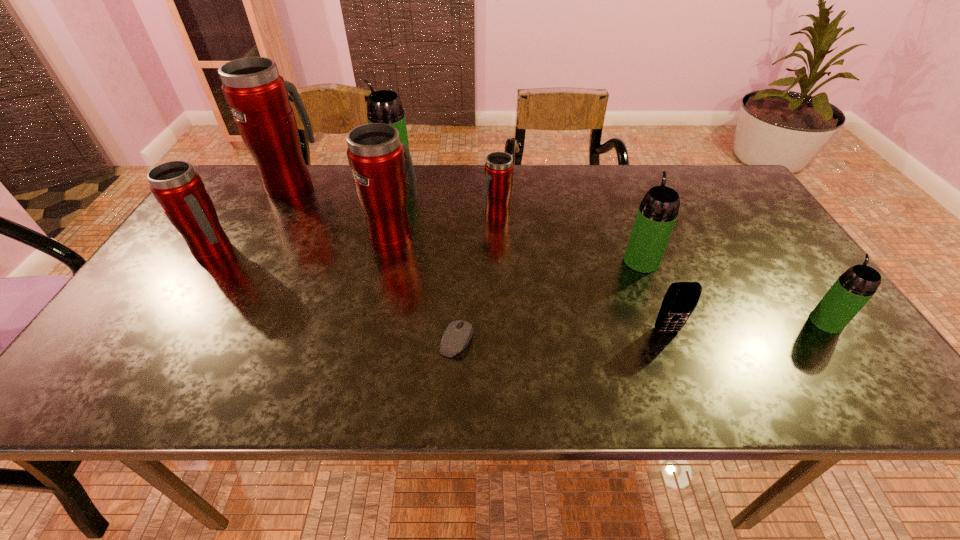
In order to click on unoccupied position between the second red thermos bottle from right to left and the second smallest red thermos bottle in this screenshot , I will do [304, 244].

The width and height of the screenshot is (960, 540). Identify the location of vacant space in between the sixth object from left to right and the second smallest red thermos bottle. (356, 234).

Where is `vacant region between the second green thermos bottle from right to left and the third biggest red thermos bottle`? This screenshot has width=960, height=540. vacant region between the second green thermos bottle from right to left and the third biggest red thermos bottle is located at coordinates (428, 256).

The height and width of the screenshot is (540, 960). Identify the location of vacant area between the nearest green thermos bottle and the tallest thermos bottle. (559, 253).

What are the coordinates of `empty space that is in between the second green thermos bottle from left to right and the shortest object` in the screenshot? It's located at (549, 301).

I want to click on blank region between the rightmost red thermos bottle and the second shortest object, so (582, 273).

Find the location of a particular element. This screenshot has width=960, height=540. empty space between the second shortest object and the farthest green thermos bottle is located at coordinates (531, 253).

Find the location of a particular element. free space between the second red thermos bottle from right to left and the sixth object from left to right is located at coordinates (445, 226).

What are the coordinates of `vacant region between the cellular telephone and the fifth thermos bottle from left to right` in the screenshot? It's located at (582, 273).

Select which object appears as the second closest to the computer equipment. Please provide its 2D coordinates. Your answer should be formatted as a tuple, i.e. [(x, y)], where the tuple contains the x and y coordinates of a point satisfying the conditions above.

[(497, 186)]